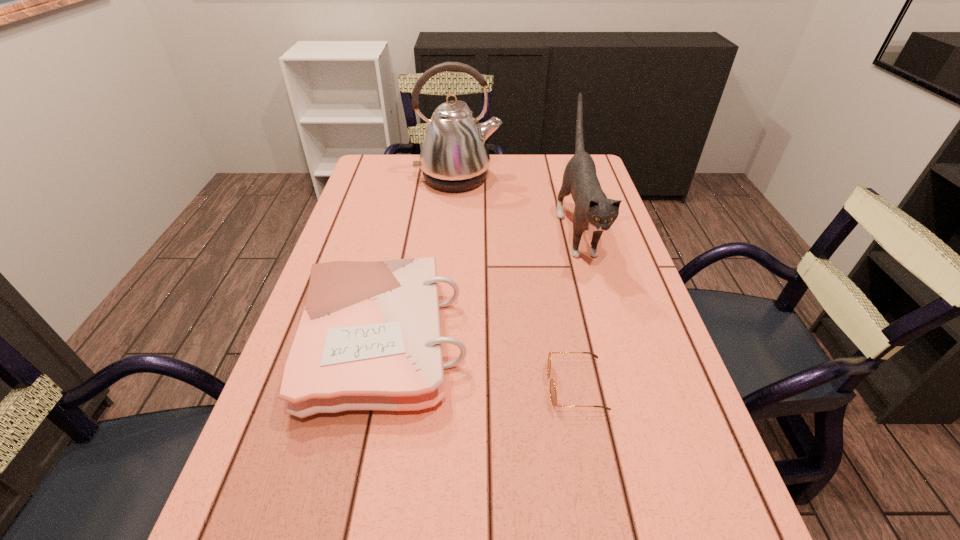
The height and width of the screenshot is (540, 960). I want to click on vacant region at the far right corner, so click(x=552, y=175).

You are a GUI agent. You are given a task and a screenshot of the screen. Output one action in this format:
    pyautogui.click(x=<x>, y=<y>)
    Task: Click on the free spot between the kettle and the cat
    
    Given the screenshot: What is the action you would take?
    pyautogui.click(x=517, y=204)

The width and height of the screenshot is (960, 540). I want to click on free area in between the phonebook and the cat, so click(480, 285).

This screenshot has height=540, width=960. In order to click on vacant space in between the phonebook and the sunglasses in this screenshot , I will do `click(479, 363)`.

Locate an element on the screen. The width and height of the screenshot is (960, 540). vacant region between the kettle and the third shortest object is located at coordinates (517, 204).

Locate an element on the screen. This screenshot has height=540, width=960. vacant space that is in between the kettle and the sunglasses is located at coordinates (516, 282).

At what (x,y) coordinates should I click in order to perform the action: click on empty space that is in between the third shortest object and the phonebook. Please return your answer as a coordinate pair (x, y). This screenshot has width=960, height=540. Looking at the image, I should click on (480, 285).

Locate which object ranks in proximity to the phonebook. Please provide its 2D coordinates. Your answer should be formatted as a tuple, i.e. [(x, y)], where the tuple contains the x and y coordinates of a point satisfying the conditions above.

[(553, 394)]

The height and width of the screenshot is (540, 960). I want to click on object that stands as the third closest to the shortest object, so click(454, 157).

You are a GUI agent. You are given a task and a screenshot of the screen. Output one action in this format:
    pyautogui.click(x=<x>, y=<y>)
    Task: Click on the vacant space that satisfies the following two spatial constraints: 1. at the face of the cat; 2. on the lenses of the sunglasses
    The width and height of the screenshot is (960, 540).
    Given the screenshot: What is the action you would take?
    pyautogui.click(x=621, y=386)